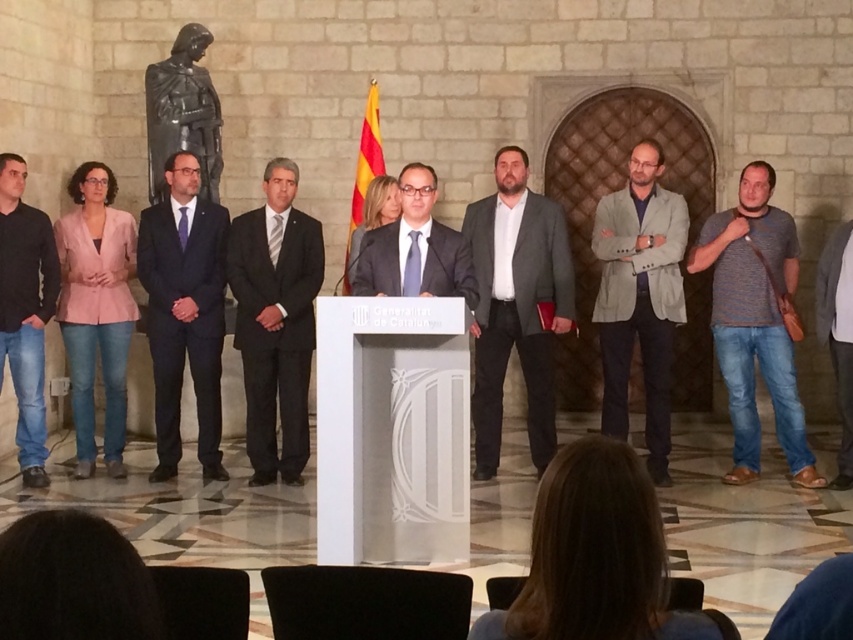
Question: Is light gray textured blazer at center thinner than bronze statue at upper left?

Choices:
 (A) yes
 (B) no

Answer: (B)

Question: Based on their relative distances, which object is farther from the bronze statue at upper left?

Choices:
 (A) gray wool suit at center
 (B) black suit at center
 (C) gray striped t-shirt at right
 (D) jeans at left

Answer: (C)

Question: Which point is closer to the camera?

Choices:
 (A) gray striped t-shirt at right
 (B) bronze statue at upper left

Answer: (A)

Question: Can you confirm if gray striped t-shirt at right is positioned to the left of dark blue suit at center?

Choices:
 (A) no
 (B) yes

Answer: (A)

Question: Is black suit at center wider than jeans at left?

Choices:
 (A) no
 (B) yes

Answer: (B)

Question: Which object is positioned farthest from the dark blue suit at center?

Choices:
 (A) light gray textured blazer at center
 (B) bronze statue at upper left
 (C) jeans at left

Answer: (A)